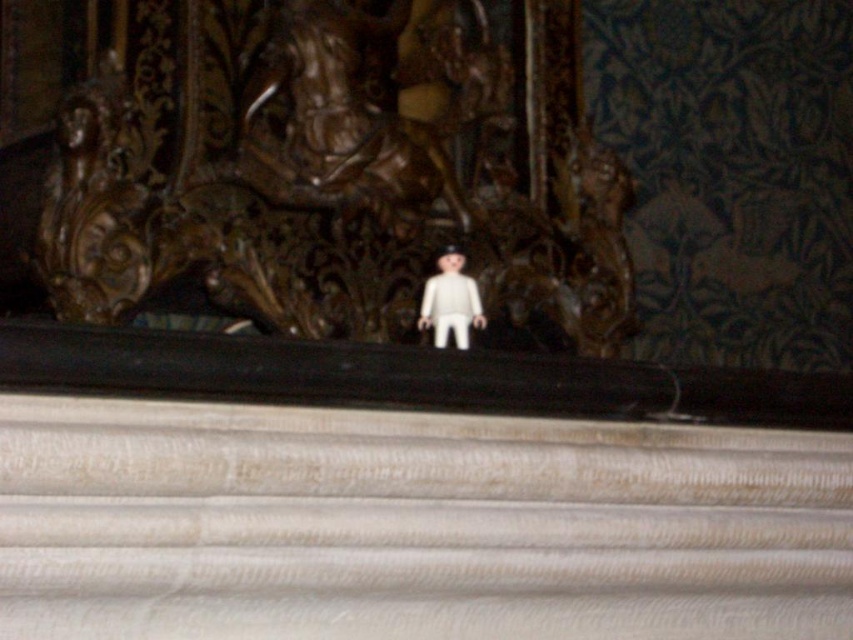
Can you confirm if brown wood carving at center is positioned above white plastic doll at center?

Indeed, brown wood carving at center is positioned over white plastic doll at center.

Who is positioned more to the left, brown wood carving at center or white plastic doll at center?

brown wood carving at center

Is point (376, 326) less distant than point (457, 332)?

No, (376, 326) is further to viewer.

The image size is (853, 640). What are the coordinates of `brown wood carving at center` in the screenshot? It's located at (334, 168).